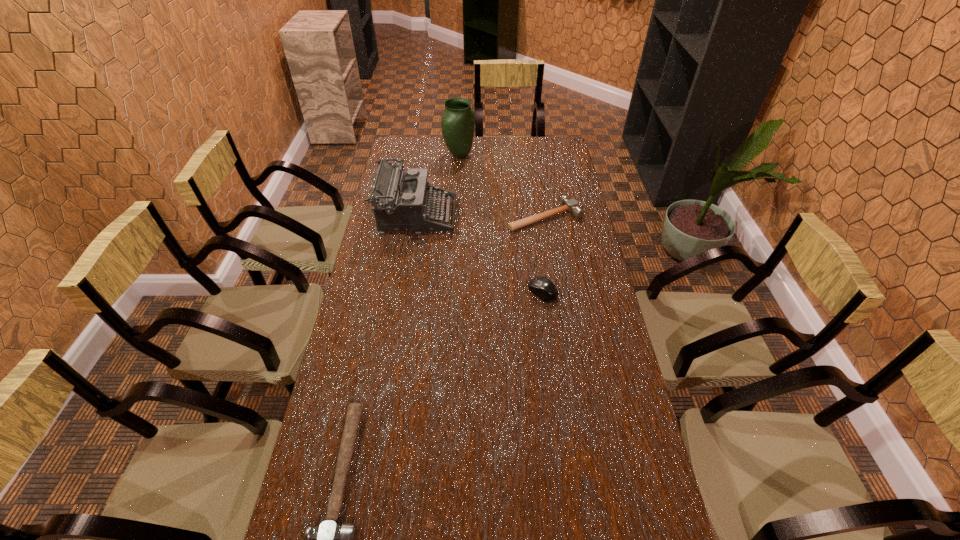
This screenshot has width=960, height=540. What are the coordinates of `object at the left edge` in the screenshot? It's located at (401, 202).

Where is `mouse positioned at the right edge`? mouse positioned at the right edge is located at coordinates (542, 287).

The width and height of the screenshot is (960, 540). In order to click on hammer situated at the right edge in this screenshot , I will do `click(571, 205)`.

In the image, there is a desktop. At what (x,y) coordinates should I click in order to perform the action: click on vacant space at the far edge. Please return your answer as a coordinate pair (x, y). The width and height of the screenshot is (960, 540). Looking at the image, I should click on (517, 159).

This screenshot has height=540, width=960. Identify the location of vacant space at the left edge of the desktop. (313, 512).

This screenshot has height=540, width=960. In the image, there is a desktop. Find the location of `vacant space at the right edge`. vacant space at the right edge is located at coordinates (588, 324).

Identify the location of empty space that is in between the vase and the second nearest object. The image size is (960, 540). (501, 224).

Image resolution: width=960 pixels, height=540 pixels. I want to click on vacant space that's between the mouse and the farther hammer, so click(543, 254).

Find the location of a particular element. The height and width of the screenshot is (540, 960). vacant area that lies between the typewriter and the mouse is located at coordinates (479, 254).

At what (x,y) coordinates should I click in order to perform the action: click on vacant space in between the fourth shortest object and the vase. Please return your answer as a coordinate pair (x, y). Looking at the image, I should click on (438, 186).